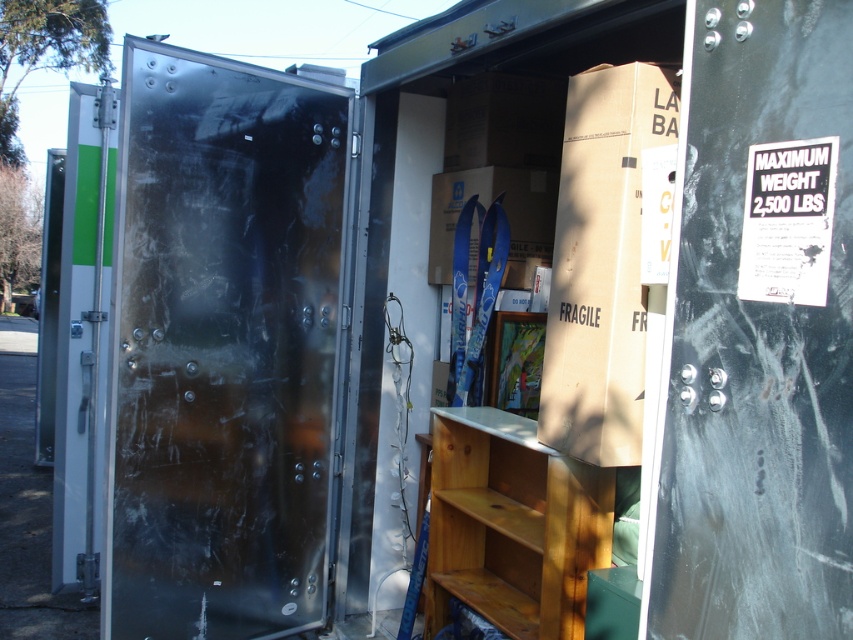
Question: Does metallic silver door at left appear over brown cardboard box at center?

Choices:
 (A) yes
 (B) no

Answer: (B)

Question: Does metallic silver door at left appear over silver metallic door at left?

Choices:
 (A) no
 (B) yes

Answer: (A)

Question: Among these objects, which one is farthest from the camera?

Choices:
 (A) metallic silver door at left
 (B) brown cardboard box at center
 (C) silver metallic door at left

Answer: (C)

Question: Can you confirm if metallic silver door at left is bigger than silver metallic door at left?

Choices:
 (A) yes
 (B) no

Answer: (A)

Question: Estimate the real-world distances between objects in this image. Which object is closer to the silver metallic door at left?

Choices:
 (A) brown cardboard box at center
 (B) metallic silver door at left

Answer: (B)

Question: Which of the following is the closest to the observer?

Choices:
 (A) metallic silver door at left
 (B) brown cardboard box at center
 (C) silver metallic door at left

Answer: (B)